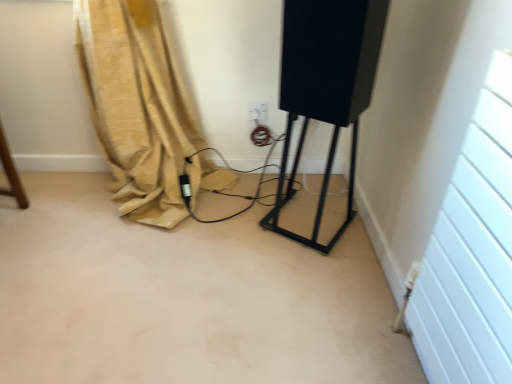
Question: Can white plastic electric outlet at center be found inside beige fabric curtain at lower left?

Choices:
 (A) no
 (B) yes

Answer: (A)

Question: Does beige fabric curtain at lower left come in front of white plastic electric outlet at center?

Choices:
 (A) no
 (B) yes

Answer: (B)

Question: Considering the relative sizes of beige fabric curtain at lower left and white plastic electric outlet at center in the image provided, is beige fabric curtain at lower left smaller than white plastic electric outlet at center?

Choices:
 (A) no
 (B) yes

Answer: (A)

Question: Is beige fabric curtain at lower left in contact with white plastic electric outlet at center?

Choices:
 (A) no
 (B) yes

Answer: (A)

Question: From the image's perspective, is beige fabric curtain at lower left over white plastic electric outlet at center?

Choices:
 (A) no
 (B) yes

Answer: (A)

Question: Is beige fabric curtain at lower left facing towards white plastic electric outlet at center?

Choices:
 (A) no
 (B) yes

Answer: (A)

Question: From the image's perspective, is white plastic electric outlet at center on black matte speaker at center?

Choices:
 (A) no
 (B) yes

Answer: (B)

Question: Does white plastic electric outlet at center touch black matte speaker at center?

Choices:
 (A) yes
 (B) no

Answer: (B)

Question: Can you confirm if white plastic electric outlet at center is wider than black matte speaker at center?

Choices:
 (A) no
 (B) yes

Answer: (A)

Question: Does white plastic electric outlet at center have a smaller size compared to black matte speaker at center?

Choices:
 (A) no
 (B) yes

Answer: (B)

Question: Is white plastic electric outlet at center not close to black matte speaker at center?

Choices:
 (A) no
 (B) yes

Answer: (A)

Question: Is white plastic electric outlet at center not inside black matte speaker at center?

Choices:
 (A) no
 (B) yes

Answer: (B)

Question: Considering the relative sizes of black matte speaker at center and white plastic electric outlet at center in the image provided, is black matte speaker at center bigger than white plastic electric outlet at center?

Choices:
 (A) no
 (B) yes

Answer: (B)